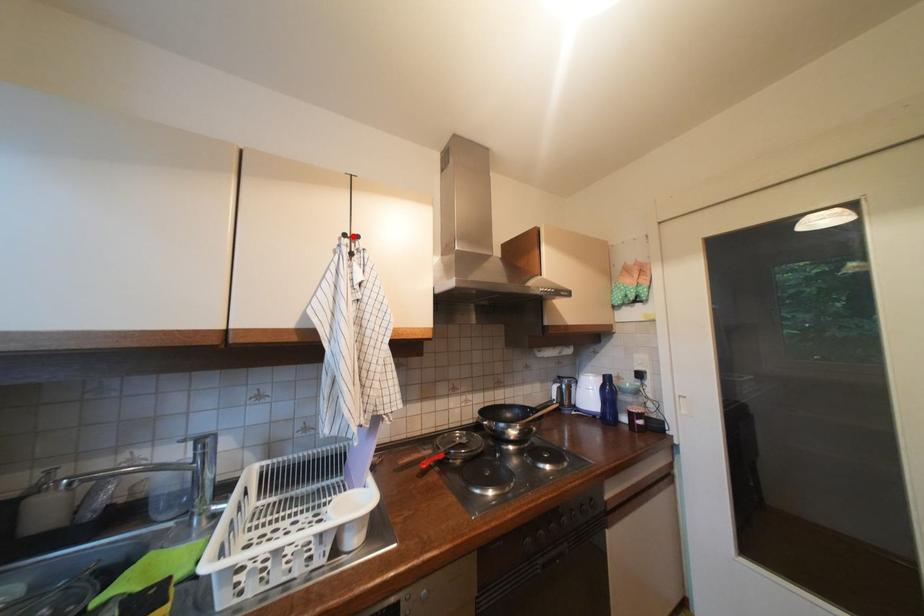
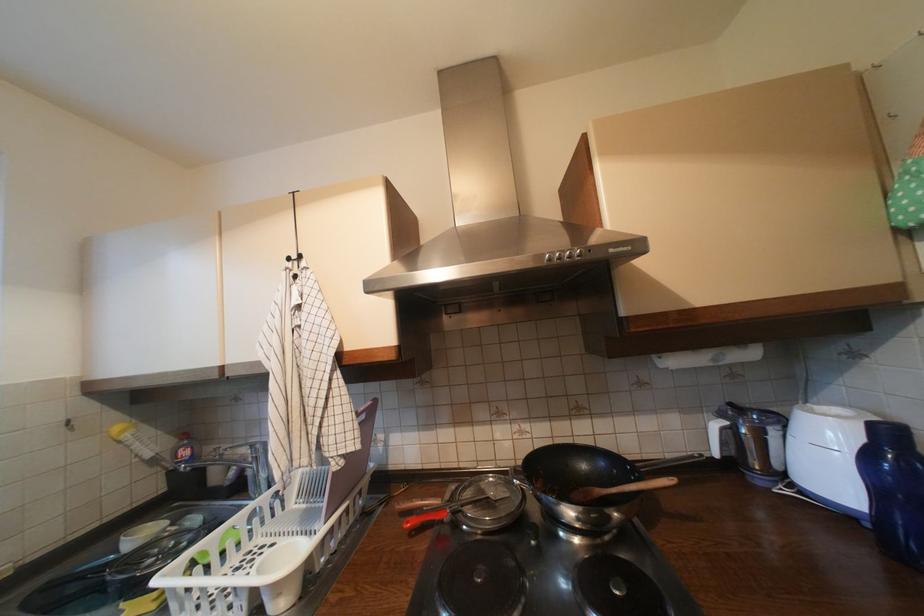
Find the pixel in the second image that matches the highlighted location in the first image.

(297, 260)